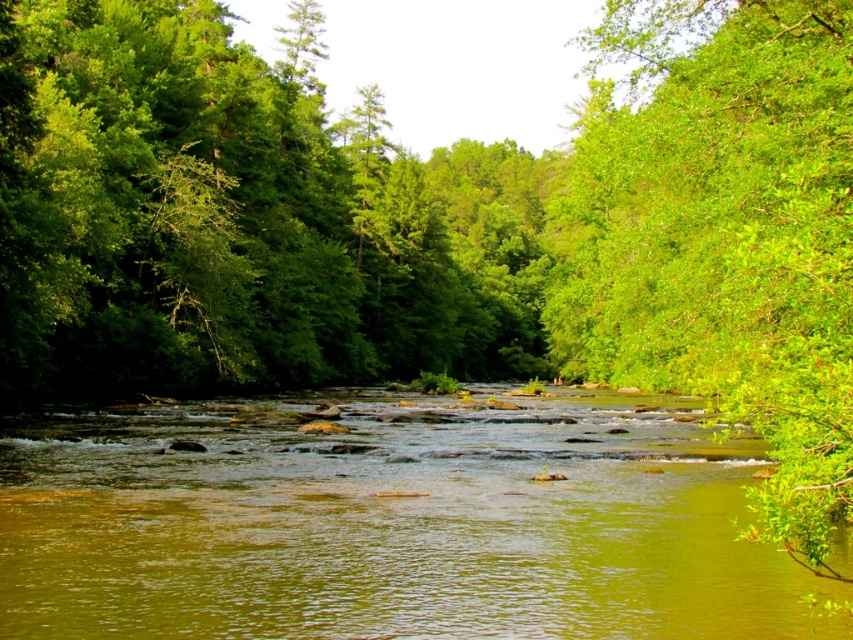
Question: Based on their relative distances, which object is nearer to the green smooth water at center?

Choices:
 (A) green leafy tree at right
 (B) green leafy tree at center

Answer: (A)

Question: Based on their relative distances, which object is farther from the green leafy tree at center?

Choices:
 (A) green smooth water at center
 (B) green leafy tree at right

Answer: (A)

Question: Can you confirm if green smooth water at center is wider than green leafy tree at center?

Choices:
 (A) yes
 (B) no

Answer: (B)

Question: Is green leafy tree at center to the left of green leafy tree at right from the viewer's perspective?

Choices:
 (A) no
 (B) yes

Answer: (B)

Question: Which of the following is the closest to the observer?

Choices:
 (A) (276, 481)
 (B) (721, 385)

Answer: (B)

Question: Is green leafy tree at center bigger than green leafy tree at right?

Choices:
 (A) no
 (B) yes

Answer: (B)